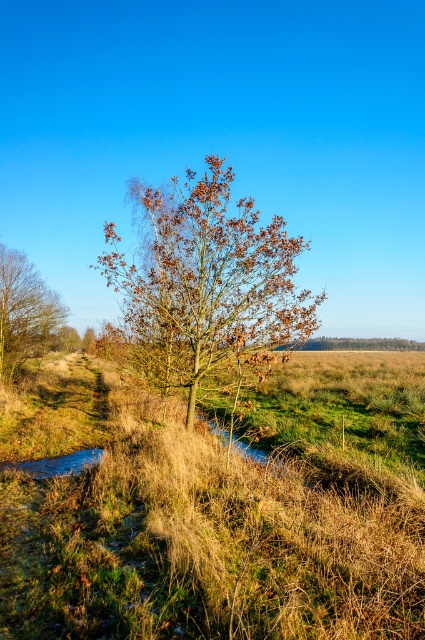
You are standing at the edge of the field in the midground and want to walk to the shiny blue puddle at lower left without getting your shoes wet. Is there a path that avoids the brown leafy tree at center?

The brown leafy tree at center is positioned over the shiny blue puddle at lower left, so there is no path around it without stepping on the puddle. You might need to go around the tree or find another route.

You are standing at the edge of the field in the midground and want to walk to the shiny blue puddle at lower left. Will the brown leafy tree at center block your path?

The brown leafy tree at center is in front of the shiny blue puddle at lower left, so it will block your path to the puddle.